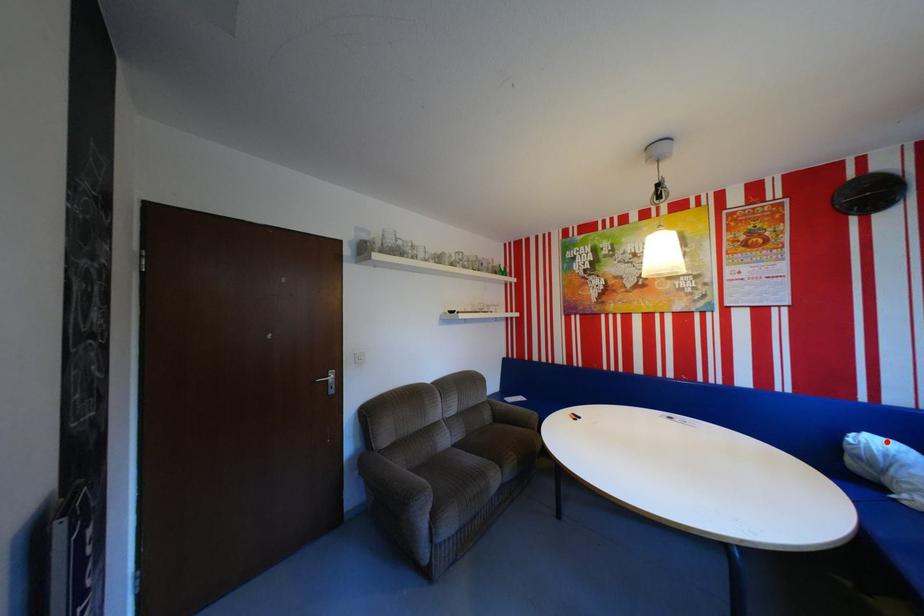
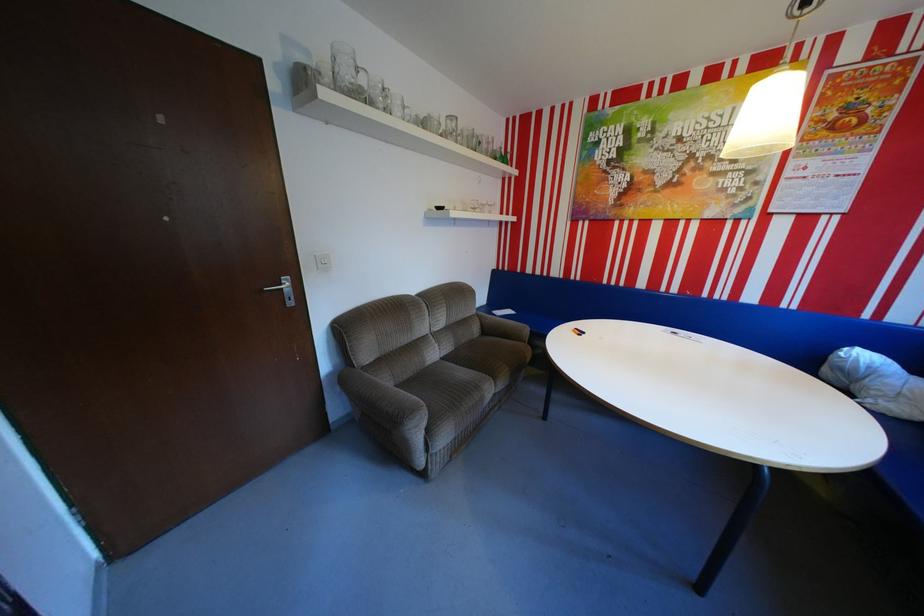
Question: I am providing you with two images of the same scene from different viewpoints. Image1 has a red point marked. In image2, the corresponding 3D location appears at what relative position? Reply with the corresponding letter.

Choices:
 (A) Closer
 (B) Farther

Answer: (B)